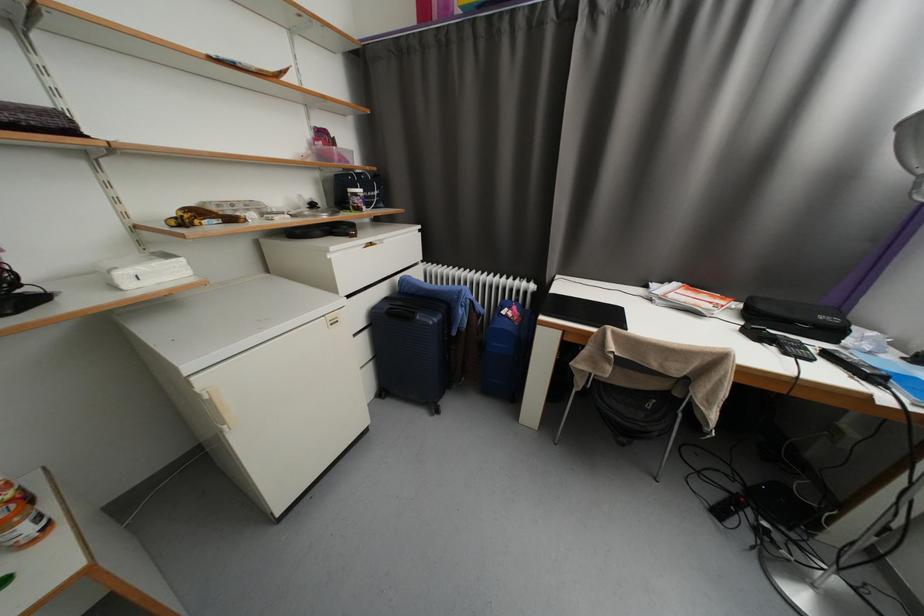
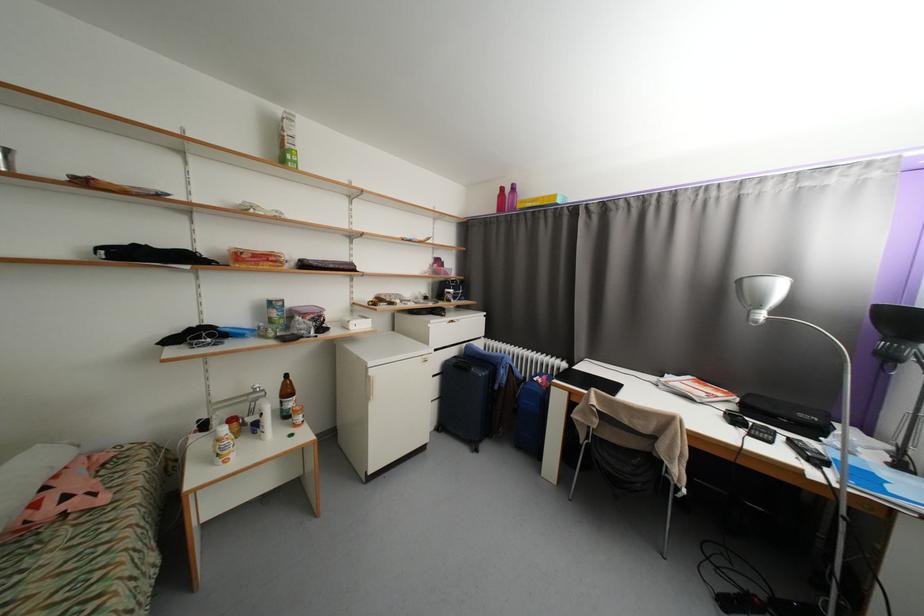
Where in the second image is the point corresponding to (604,386) from the first image?

(603, 440)